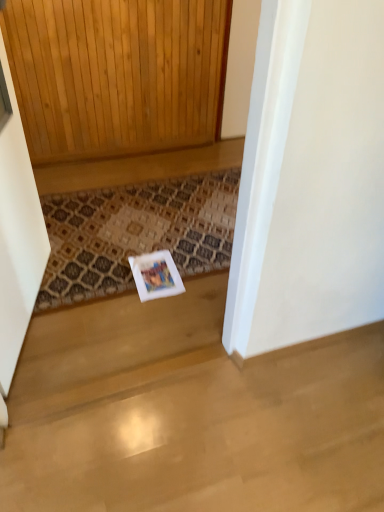
The image size is (384, 512). Identify the location of free point above patterned carpet at center (from a real-world perspective). (151, 238).